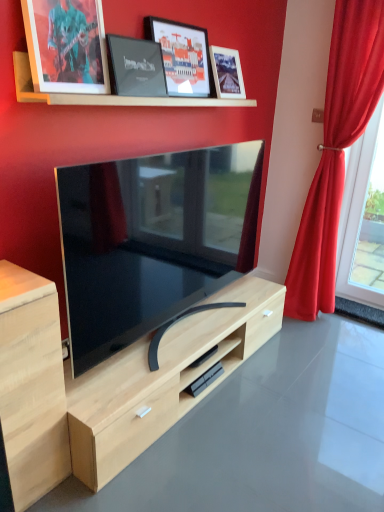
Measure the distance between point (180, 64) and camera.

The depth of point (180, 64) is 6.66 feet.

Locate an element on the screen. The height and width of the screenshot is (512, 384). matte glass picture frame at upper center, the second picture frame viewed from the right is located at coordinates (182, 56).

Locate an element on the screen. Image resolution: width=384 pixels, height=512 pixels. matte glass picture frame at upper center, the first picture frame from the right is located at coordinates (227, 73).

What do you see at coordinates (227, 73) in the screenshot? I see `matte glass picture frame at upper center, which is the fourth picture frame in left-to-right order` at bounding box center [227, 73].

Where is `wooden at upper center`? This screenshot has width=384, height=512. wooden at upper center is located at coordinates (108, 94).

Where is `light wood dresser at center`? The width and height of the screenshot is (384, 512). light wood dresser at center is located at coordinates (162, 379).

Which is in front, point (218, 82) or point (358, 288)?

The point (218, 82) is in front.

From the picture: How far apart are matte glass picture frame at upper center, the first picture frame from the right, and glass window at right?

They are 1.31 meters apart.

Is matte glass picture frame at upper center, the first picture frame from the right, aimed at glass window at right?

No, matte glass picture frame at upper center, the first picture frame from the right, is not facing towards glass window at right.

From the picture: Is matte glass picture frame at upper center, the first picture frame from the right, at the left side of glass window at right?

Indeed, matte glass picture frame at upper center, the first picture frame from the right, is positioned on the left side of glass window at right.

Which object is thinner, light wood dresser at center or wooden at upper center?

Thinner between the two is wooden at upper center.

From the picture: Is the depth of light wood dresser at center greater than that of wooden at upper center?

No, light wood dresser at center is closer to the camera.

Considering the sizes of light wood dresser at center and wooden at upper center in the image, is light wood dresser at center bigger or smaller than wooden at upper center?

In the image, light wood dresser at center appears to be larger than wooden at upper center.

Is light wood dresser at center beside wooden at upper center?

No, light wood dresser at center is not beside wooden at upper center.

In the image, there is a red velvet curtain at right. Where is `television below it (from a real-world perspective)`? This screenshot has height=512, width=384. television below it (from a real-world perspective) is located at coordinates (151, 242).

Is matte black tv at center at the back of red velvet curtain at right?

No, red velvet curtain at right's orientation is not away from matte black tv at center.

From a real-world perspective, which is physically below, red velvet curtain at right or matte black tv at center?

matte black tv at center.

Which is nearer, [314,234] or [102,306]?

Clearly, point [314,234] is more distant from the camera than point [102,306].

Does light wood dresser at center appear on the left side of matte black tv at center?

Incorrect, light wood dresser at center is not on the left side of matte black tv at center.

From a real-world perspective, which is physically below, light wood dresser at center or matte black tv at center?

In real-world perspective, light wood dresser at center is lower.

Considering the relative sizes of light wood dresser at center and matte black tv at center in the image provided, is light wood dresser at center thinner than matte black tv at center?

In fact, light wood dresser at center might be wider than matte black tv at center.

Does matte black tv at center have a greater height compared to wooden at upper center?

Indeed, matte black tv at center has a greater height compared to wooden at upper center.

From the image's perspective, is matte black tv at center beneath wooden at upper center?

Yes, from the image's perspective, matte black tv at center is beneath wooden at upper center.

How different are the orientations of matte black tv at center and wooden at upper center in degrees?

0.826 degrees.

In the image, is matte black tv at center positioned in front of or behind wooden at upper center?

Visually, matte black tv at center is located in front of wooden at upper center.

How many degrees apart are the facing directions of red velvet curtain at right and matte glass picture frame at upper center, which is the fourth picture frame in left-to-right order?

88 degrees.

Does point (354, 31) appear closer or farther from the camera than point (236, 93)?

Clearly, point (354, 31) is more distant from the camera than point (236, 93).

From the picture: From the image's perspective, is red velvet curtain at right above or below matte glass picture frame at upper center, which is the fourth picture frame in left-to-right order?

Based on their image positions, red velvet curtain at right is located beneath matte glass picture frame at upper center, which is the fourth picture frame in left-to-right order.

Measure the distance between red velvet curtain at right and matte glass picture frame at upper center, which is the fourth picture frame in left-to-right order.

35.63 inches.

Visually, is matte glass picture frame at upper center, the second picture frame viewed from the right, positioned to the left or to the right of matte glass picture frame at upper center, the first picture frame from the right?

Clearly, matte glass picture frame at upper center, the second picture frame viewed from the right, is on the left of matte glass picture frame at upper center, the first picture frame from the right, in the image.

From the picture: In terms of width, does matte glass picture frame at upper center, the second picture frame viewed from the right, look wider or thinner when compared to matte glass picture frame at upper center, the first picture frame from the right?

Considering their sizes, matte glass picture frame at upper center, the second picture frame viewed from the right, looks slimmer than matte glass picture frame at upper center, the first picture frame from the right.

Which object is further away from the camera, matte glass picture frame at upper center, arranged as the third picture frame when viewed from the left, or matte glass picture frame at upper center, which is the fourth picture frame in left-to-right order?

Positioned behind is matte glass picture frame at upper center, which is the fourth picture frame in left-to-right order.

Can you tell me how much matte glass picture frame at upper center, arranged as the third picture frame when viewed from the left, and matte glass picture frame at upper center, which is the fourth picture frame in left-to-right order, differ in facing direction?

The facing directions of matte glass picture frame at upper center, arranged as the third picture frame when viewed from the left, and matte glass picture frame at upper center, which is the fourth picture frame in left-to-right order, are 1.47 degrees apart.

Find the location of `window located below the matte glass picture frame at upper center, the first picture frame from the right (from the image's perspective)`. window located below the matte glass picture frame at upper center, the first picture frame from the right (from the image's perspective) is located at coordinates (360, 224).

Locate an element on the screen. shelf on the left of light wood dresser at center is located at coordinates (108, 94).

Estimate the real-world distances between objects in this image. Which object is further from matte glass picture frame at upper center, the first picture frame from the right, glass window at right or matte black tv at center?

glass window at right.

Estimate the real-world distances between objects in this image. Which object is closer to red velvet curtain at right, matte black picture frame at upper center, positioned as the third picture frame in right-to-left order, or matte glass picture frame at upper center, the second picture frame viewed from the right?

The object closer to red velvet curtain at right is matte glass picture frame at upper center, the second picture frame viewed from the right.

Estimate the real-world distances between objects in this image. Which object is further from light wood cabinet at left, red velvet curtain at right or matte glass picture frame at upper center, the first picture frame from the right?

red velvet curtain at right is further to light wood cabinet at left.

Based on their spatial positions, is matte black picture frame at upper left, which is the 1th picture frame in left-to-right order, or matte black tv at center closer to glass window at right?

matte black tv at center lies closer to glass window at right than the other object.

Which object lies nearer to the anchor point matte black picture frame at upper center, arranged as the 2th picture frame when viewed from the left, matte glass picture frame at upper center, arranged as the third picture frame when viewed from the left, or matte black picture frame at upper left, arranged as the 4th picture frame when viewed from the right?

Based on the image, matte black picture frame at upper left, arranged as the 4th picture frame when viewed from the right, appears to be nearer to matte black picture frame at upper center, arranged as the 2th picture frame when viewed from the left.

Based on their spatial positions, is matte glass picture frame at upper center, arranged as the third picture frame when viewed from the left, or light wood cabinet at left closer to matte glass picture frame at upper center, which is the fourth picture frame in left-to-right order?

matte glass picture frame at upper center, arranged as the third picture frame when viewed from the left.

Estimate the real-world distances between objects in this image. Which object is further from wooden at upper center, light wood dresser at center or light wood cabinet at left?

light wood dresser at center is positioned further to the anchor wooden at upper center.

When comparing their distances from matte black picture frame at upper left, which is the 1th picture frame in left-to-right order, does light wood dresser at center or light wood cabinet at left seem closer?

The object closer to matte black picture frame at upper left, which is the 1th picture frame in left-to-right order, is light wood cabinet at left.

Where is `television between light wood cabinet at left and red velvet curtain at right in the horizontal direction`? The width and height of the screenshot is (384, 512). television between light wood cabinet at left and red velvet curtain at right in the horizontal direction is located at coordinates (151, 242).

In order to click on television between wooden at upper center and red velvet curtain at right in this screenshot , I will do `click(151, 242)`.

Identify the location of shelf between matte black picture frame at upper left, arranged as the 4th picture frame when viewed from the right, and matte black tv at center, in the vertical direction. point(108,94).

You are a GUI agent. You are given a task and a screenshot of the screen. Output one action in this format:
    pyautogui.click(x=<x>, y=<y>)
    Task: Click on the picture frame situated between matte glass picture frame at upper center, the second picture frame viewed from the right, and red velvet curtain at right from left to right
    Image resolution: width=384 pixels, height=512 pixels.
    Given the screenshot: What is the action you would take?
    pyautogui.click(x=227, y=73)